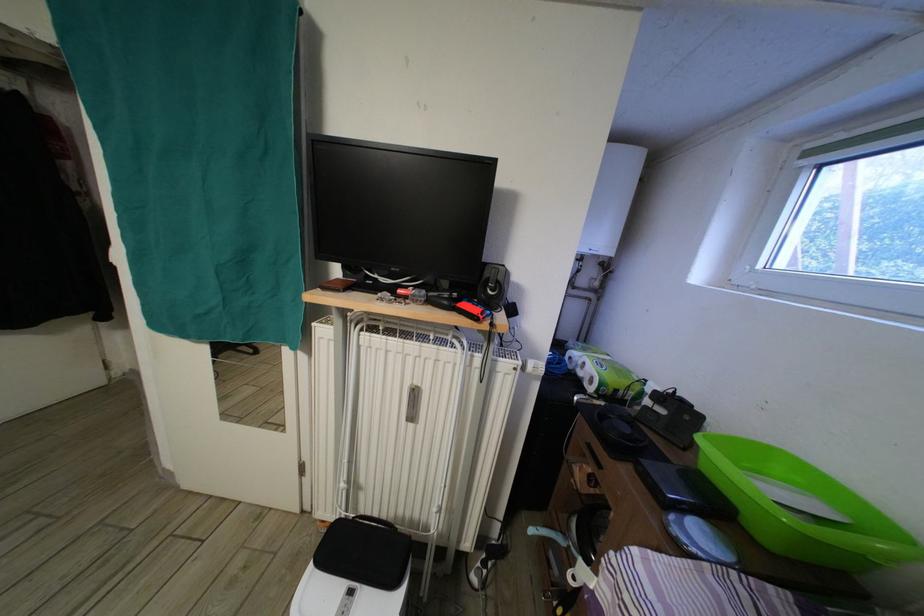
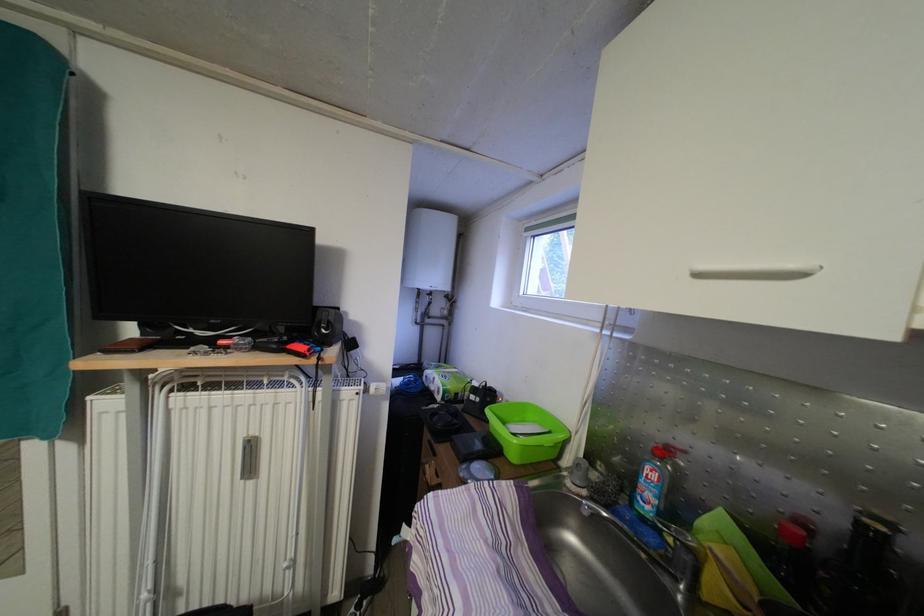
In the second image, find the point that corresponds to (694,424) in the first image.

(495, 406)